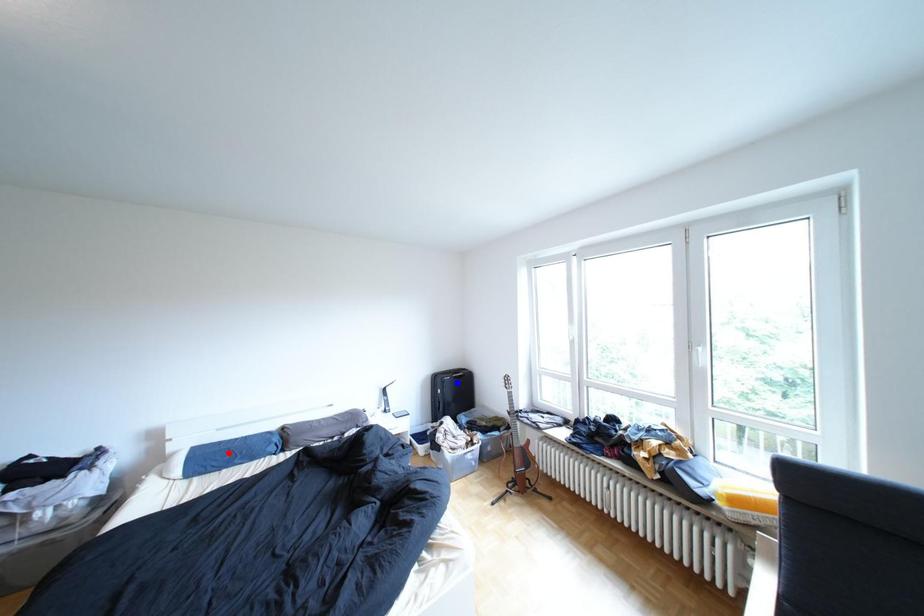
Question: Which of the two points in the image is closer to the camera?

Choices:
 (A) Blue point is closer.
 (B) Red point is closer.

Answer: (B)